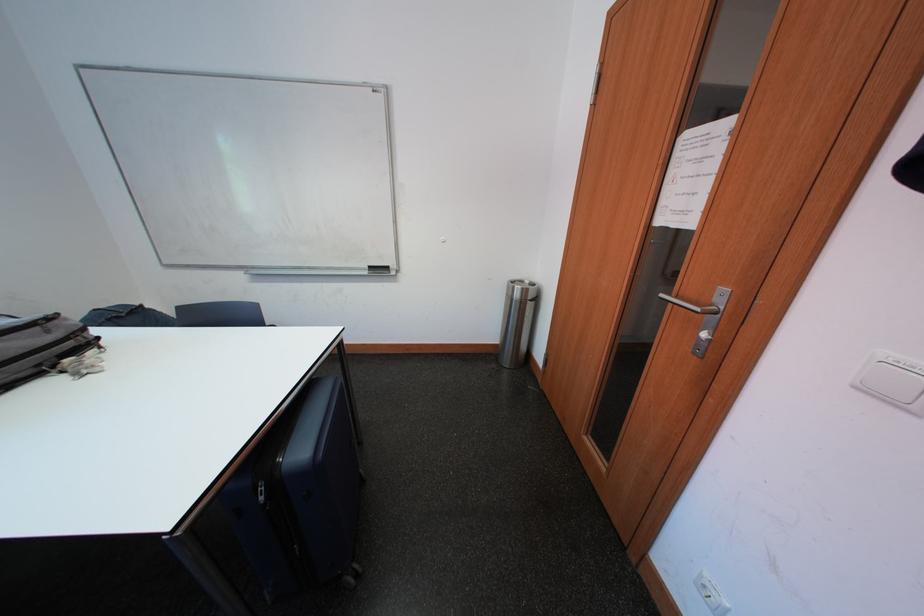
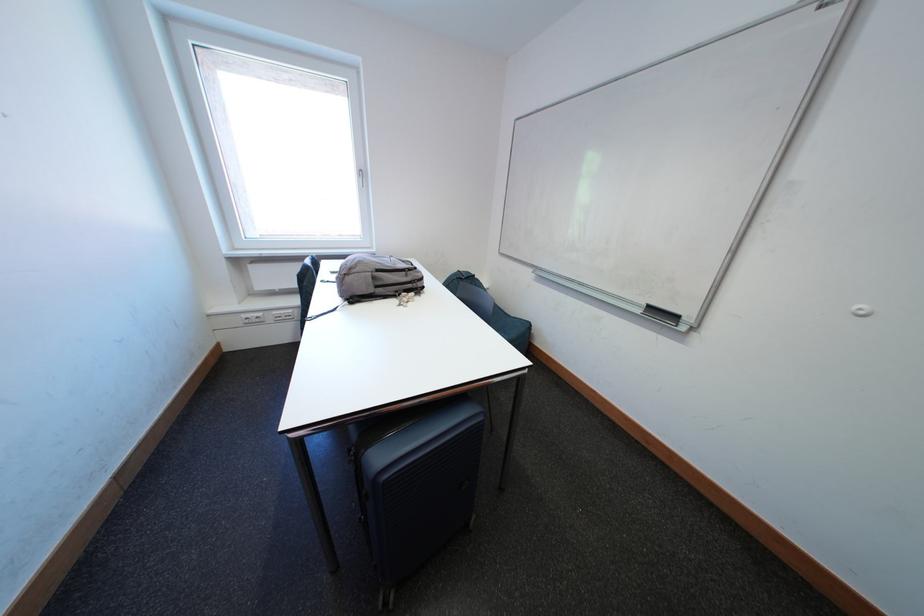
Question: How did the camera likely rotate?

Choices:
 (A) Left
 (B) Right
 (C) Up
 (D) Down

Answer: (A)